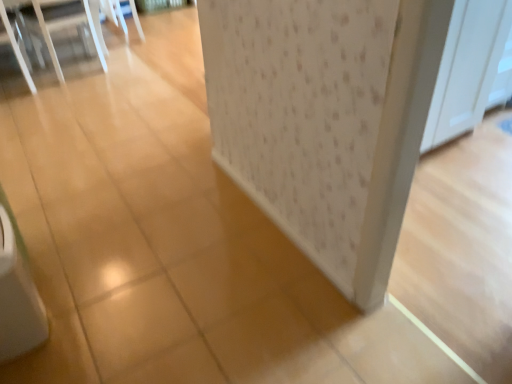
In order to face clear plastic chairs at upper left, should I rotate leftwards or rightwards?

Turn left approximately 25.267 degrees to face it.

Identify the location of clear plastic chairs at upper left. (41, 32).

Describe the element at coordinates (41, 32) in the screenshot. I see `clear plastic chairs at upper left` at that location.

The height and width of the screenshot is (384, 512). Describe the element at coordinates (467, 68) in the screenshot. I see `white wood screen door at upper right` at that location.

The image size is (512, 384). Find the location of `white wood screen door at upper right`. white wood screen door at upper right is located at coordinates (467, 68).

Locate an element on the screen. The height and width of the screenshot is (384, 512). clear plastic chairs at upper left is located at coordinates (41, 32).

Considering the relative positions of clear plastic chairs at upper left and white wood screen door at upper right in the image provided, is clear plastic chairs at upper left to the left or to the right of white wood screen door at upper right?

Clearly, clear plastic chairs at upper left is on the left of white wood screen door at upper right in the image.

In the image, is clear plastic chairs at upper left positioned in front of or behind white wood screen door at upper right?

Visually, clear plastic chairs at upper left is located behind white wood screen door at upper right.

Which point is more forward, (31, 87) or (510, 18)?

Positioned in front is point (510, 18).

From the image's perspective, does clear plastic chairs at upper left appear lower than white wood screen door at upper right?

No, from the image's perspective, clear plastic chairs at upper left is not beneath white wood screen door at upper right.

From a real-world perspective, between clear plastic chairs at upper left and white wood screen door at upper right, who is vertically higher?

white wood screen door at upper right, from a real-world perspective.

Is clear plastic chairs at upper left wider than white wood screen door at upper right?

Yes.

Based on the photo, which of these two, clear plastic chairs at upper left or white wood screen door at upper right, stands taller?

Standing taller between the two is white wood screen door at upper right.

Who is bigger, clear plastic chairs at upper left or white wood screen door at upper right?

clear plastic chairs at upper left is bigger.

Is clear plastic chairs at upper left inside the boundaries of white wood screen door at upper right, or outside?

clear plastic chairs at upper left is spatially situated outside white wood screen door at upper right.

Is clear plastic chairs at upper left directly adjacent to white wood screen door at upper right?

clear plastic chairs at upper left is not next to white wood screen door at upper right, and they're not touching.

Consider the image. Is clear plastic chairs at upper left looking in the opposite direction of white wood screen door at upper right?

No, white wood screen door at upper right is not at the back of clear plastic chairs at upper left.

Locate an element on the screen. Image resolution: width=512 pixels, height=384 pixels. screen door that appears on the right of clear plastic chairs at upper left is located at coordinates (467, 68).

Is white wood screen door at upper right at the right side of clear plastic chairs at upper left?

Yes.

Which object is more forward, white wood screen door at upper right or clear plastic chairs at upper left?

white wood screen door at upper right.

Is point (471, 82) farther from camera compared to point (116, 8)?

No, it is in front of (116, 8).

From the image's perspective, which is below, white wood screen door at upper right or clear plastic chairs at upper left?

white wood screen door at upper right is shown below in the image.

From a real-world perspective, is white wood screen door at upper right positioned above or below clear plastic chairs at upper left?

Clearly, from a real-world perspective, white wood screen door at upper right is above clear plastic chairs at upper left.

In terms of width, does white wood screen door at upper right look wider or thinner when compared to clear plastic chairs at upper left?

Clearly, white wood screen door at upper right has less width compared to clear plastic chairs at upper left.

In terms of height, does white wood screen door at upper right look taller or shorter compared to clear plastic chairs at upper left?

In the image, white wood screen door at upper right appears to be taller than clear plastic chairs at upper left.

Between white wood screen door at upper right and clear plastic chairs at upper left, which one has smaller size?

white wood screen door at upper right is smaller.

Is white wood screen door at upper right not within clear plastic chairs at upper left?

white wood screen door at upper right is positioned outside clear plastic chairs at upper left.

Looking at this image, is white wood screen door at upper right placed right next to clear plastic chairs at upper left?

white wood screen door at upper right and clear plastic chairs at upper left are not in contact.

In the scene shown: Is white wood screen door at upper right looking in the opposite direction of clear plastic chairs at upper left?

No, white wood screen door at upper right is not facing away from clear plastic chairs at upper left.

Can you tell me how much white wood screen door at upper right and clear plastic chairs at upper left differ in facing direction?

0.713 degrees.

This screenshot has width=512, height=384. I want to click on screen door on the right of clear plastic chairs at upper left, so click(467, 68).

Find the location of `furniture lying on the left of white wood screen door at upper right`. furniture lying on the left of white wood screen door at upper right is located at coordinates (41, 32).

The width and height of the screenshot is (512, 384). Find the location of `screen door above the clear plastic chairs at upper left (from a real-world perspective)`. screen door above the clear plastic chairs at upper left (from a real-world perspective) is located at coordinates (467, 68).